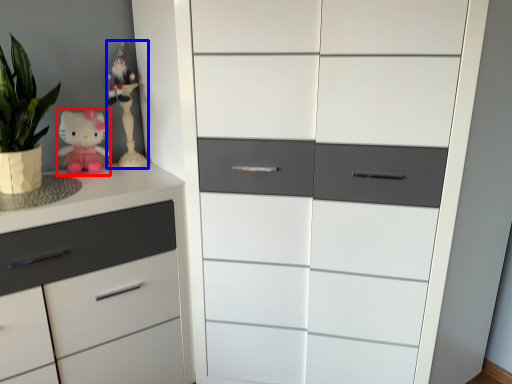
Question: Which object appears closest to the camera in this image, doll (highlighted by a red box) or miniature (highlighted by a blue box)?

Choices:
 (A) doll
 (B) miniature

Answer: (A)